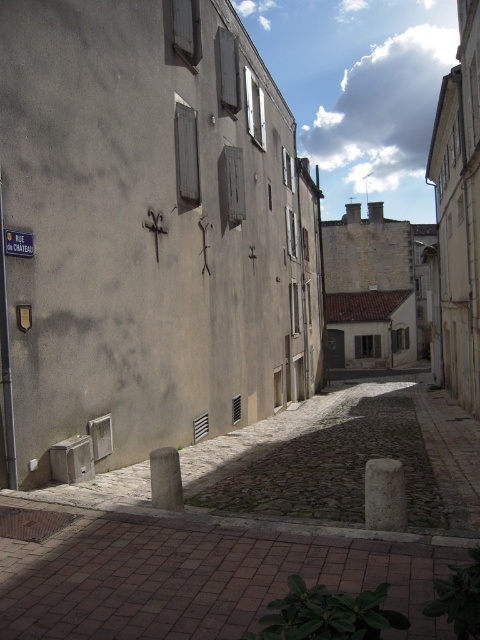
Question: Can you confirm if brick pavement at lower center is positioned above white painted wood shutter at upper center?

Choices:
 (A) no
 (B) yes

Answer: (A)

Question: Does wooden textured shutter at center appear on the left side of blue plastic street sign at upper left?

Choices:
 (A) no
 (B) yes

Answer: (A)

Question: Based on their relative distances, which object is farther from the wooden shutter at center?

Choices:
 (A) white painted wood shutter at upper center
 (B) blue plastic street sign at upper left
 (C) brick pavement at lower center
 (D) wooden shutter at upper center

Answer: (C)

Question: Which object is the farthest from the blue plastic street sign at upper left?

Choices:
 (A) wooden shutter at center
 (B) wooden textured shutter at center
 (C) wooden shutter at upper center

Answer: (C)

Question: Which of the following is the farthest from the observer?

Choices:
 (A) wooden shutter at upper center
 (B) white painted wood shutter at upper center
 (C) wooden shutter at center
 (D) blue plastic street sign at upper left

Answer: (B)

Question: In this image, where is wooden shutter at center located relative to blue plastic street sign at upper left?

Choices:
 (A) right
 (B) left

Answer: (A)